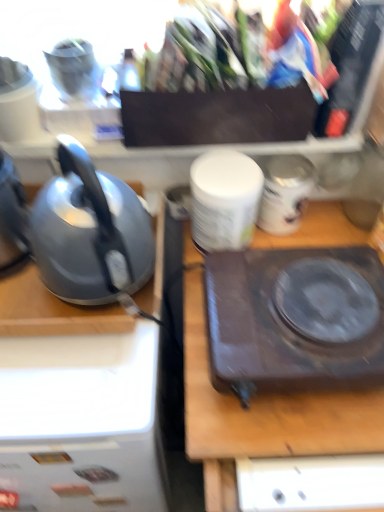
Identify the location of blank space situated above dark brown plastic hot plate at center (from a real-world perspective). pos(307,306).